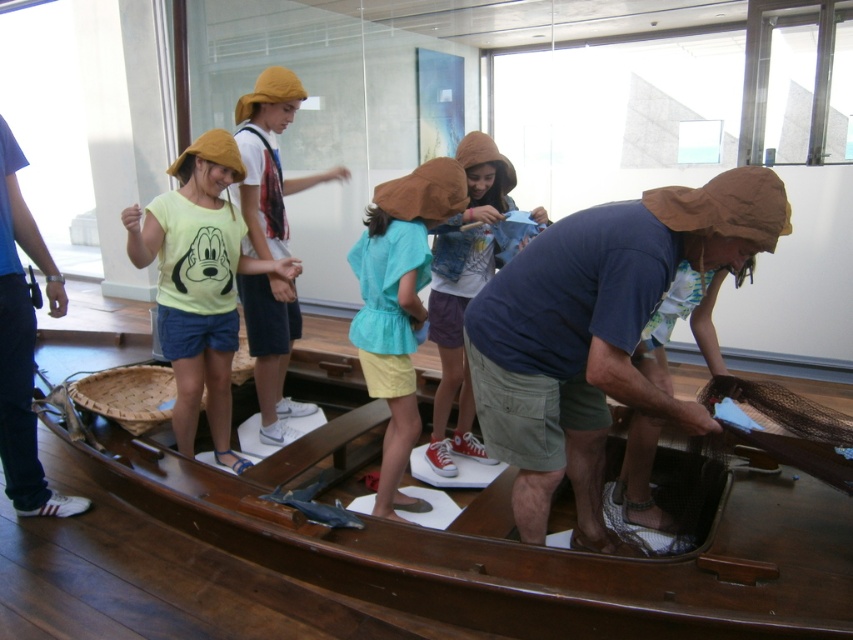
Question: Is matte yellow hat at upper center to the left of denim jacket at center from the viewer's perspective?

Choices:
 (A) no
 (B) yes

Answer: (B)

Question: Which of the following is the closest to the observer?

Choices:
 (A) (268, 220)
 (B) (190, 432)
 (C) (402, 282)

Answer: (C)

Question: Does wooden boat at center have a larger size compared to light blue cotton shirt at center?

Choices:
 (A) yes
 (B) no

Answer: (A)

Question: Which point is closer to the camera?

Choices:
 (A) blue denim jeans at lower left
 (B) brown fabric hat at center
 (C) denim jacket at center

Answer: (B)

Question: Which of the following is the farthest from the observer?

Choices:
 (A) wooden boat at center
 (B) brown fabric hat at center
 (C) denim jacket at center

Answer: (C)

Question: Is matte yellow hat at upper center positioned behind blue denim jeans at lower left?

Choices:
 (A) no
 (B) yes

Answer: (B)